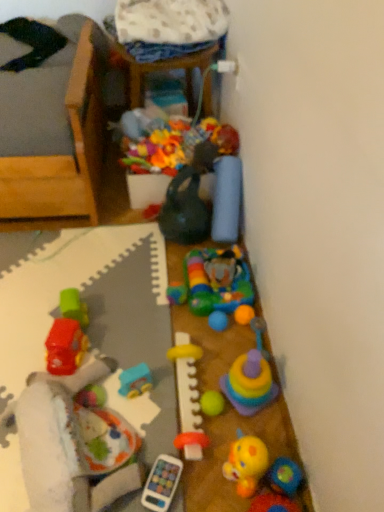
The height and width of the screenshot is (512, 384). What are the coordinates of `vacant point to the right of yellow rubber teething ring at center, the 4th toy from the left` in the screenshot? It's located at (248, 420).